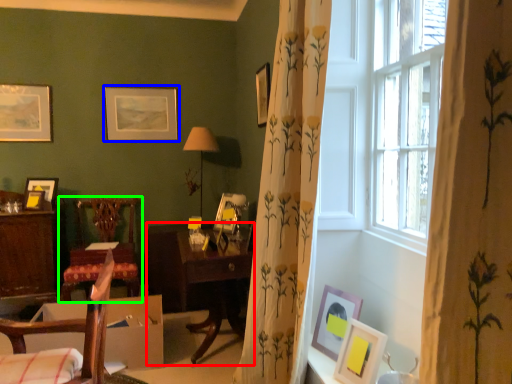
Question: Based on their relative distances, which object is nearer to table (highlighted by a red box)? Choose from picture frame (highlighted by a blue box) and chair (highlighted by a green box).

Choices:
 (A) picture frame
 (B) chair

Answer: (B)